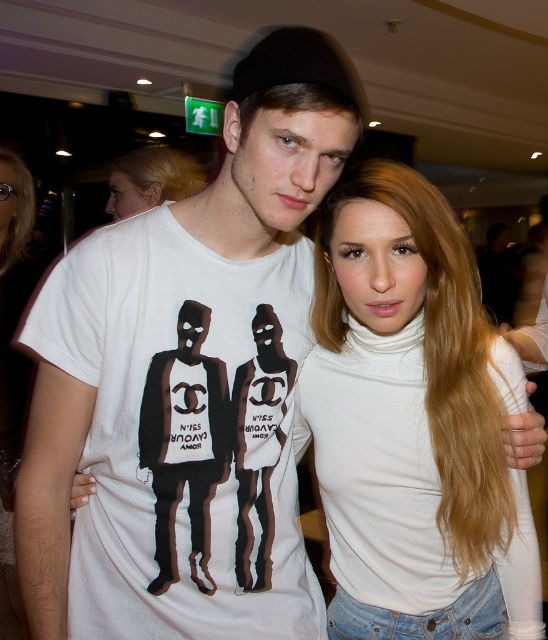
Is point (226, 550) positioned before point (476, 388)?

Yes, it is.

Does white cotton t-shirt at center have a lesser height compared to white turtleneck at center?

Yes.

Identify the location of white cotton t-shirt at center. (184, 433).

Identify the location of white cotton t-shirt at center. The width and height of the screenshot is (548, 640). (184, 433).